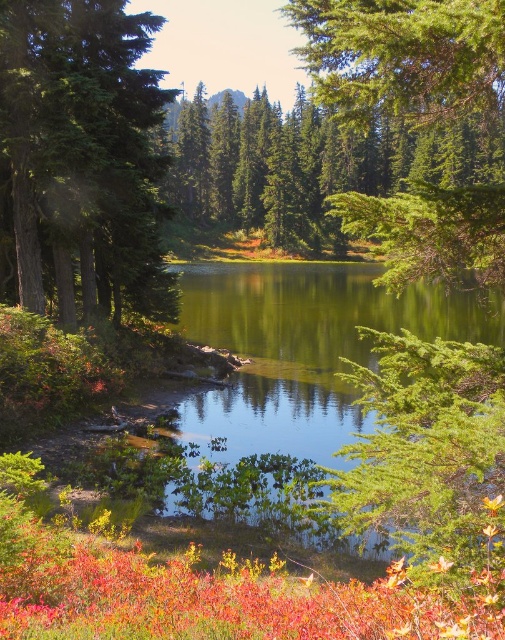
Question: Among these objects, which one is nearest to the camera?

Choices:
 (A) green matte tree at left
 (B) green reflective water at center

Answer: (B)

Question: Which object is farther from the camera taking this photo?

Choices:
 (A) green matte tree at left
 (B) green reflective water at center
 (C) green textured tree at upper right

Answer: (A)

Question: Is green reflective water at center in front of green textured tree at upper right?

Choices:
 (A) no
 (B) yes

Answer: (A)

Question: Which of the following is the closest to the observer?

Choices:
 (A) (15, 163)
 (B) (225, 394)
 (C) (437, 12)

Answer: (C)

Question: Can you confirm if green reflective water at center is positioned below green textured tree at upper right?

Choices:
 (A) no
 (B) yes

Answer: (B)

Question: Is green matte tree at left thinner than green textured tree at upper right?

Choices:
 (A) no
 (B) yes

Answer: (B)